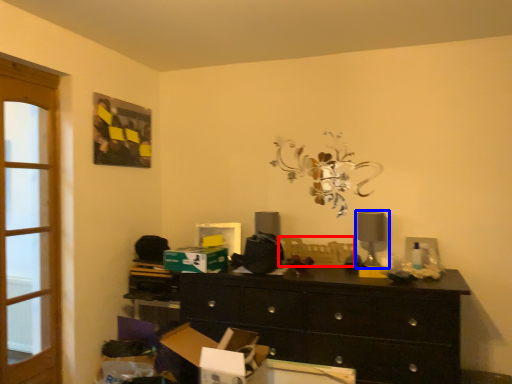
Question: Which point is closer to the camera, swivel chair (highlighted by a red box) or table lamp (highlighted by a blue box)?

Choices:
 (A) swivel chair
 (B) table lamp

Answer: (B)